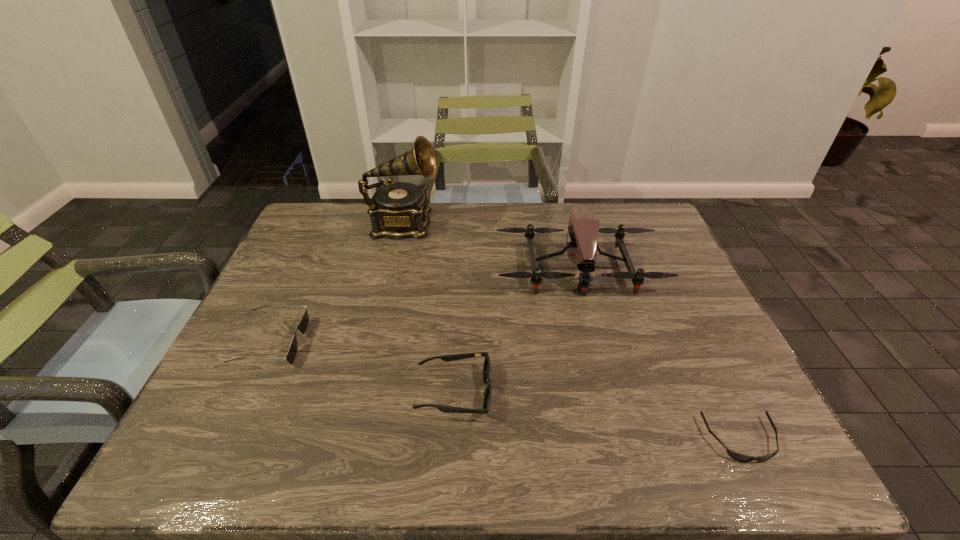
You are a GUI agent. You are given a task and a screenshot of the screen. Output one action in this format:
    pyautogui.click(x=<x>, y=<y>)
    Task: Click on the vacant area between the second sunglasses from right to left and the tallest object
    This screenshot has width=960, height=540.
    Given the screenshot: What is the action you would take?
    pyautogui.click(x=429, y=308)

Identify the location of blank region between the drone and the second sunglasses from left to right. The width and height of the screenshot is (960, 540). (516, 330).

Where is `free space that is in between the shortest object and the leftmost sunglasses`? free space that is in between the shortest object and the leftmost sunglasses is located at coordinates (506, 391).

The image size is (960, 540). What are the coordinates of `empty space that is in between the leftmost object and the drone` in the screenshot? It's located at (424, 305).

The width and height of the screenshot is (960, 540). In order to click on object identified as the closest to the tallest object in this screenshot , I will do `click(583, 227)`.

The height and width of the screenshot is (540, 960). In order to click on object that is the closest to the shortest sunglasses in this screenshot , I will do `click(583, 227)`.

What are the coordinates of `sunglasses that can be found as the second closest to the shortest object` in the screenshot? It's located at (303, 325).

Where is `sunglasses that is the closest to the shortest object`? sunglasses that is the closest to the shortest object is located at coordinates click(447, 358).

Image resolution: width=960 pixels, height=540 pixels. I want to click on vacant space that satisfies the following two spatial constraints: 1. on the front-facing side of the drone; 2. on the front-facing side of the second sunglasses from right to left, so click(x=610, y=392).

Locate an element on the screen. The width and height of the screenshot is (960, 540). vacant position in the image that satisfies the following two spatial constraints: 1. on the front-facing side of the second tallest object; 2. on the front-facing side of the second sunglasses from right to left is located at coordinates (610, 392).